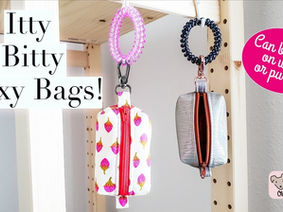
Find the location of `white wall`. white wall is located at coordinates (158, 87).